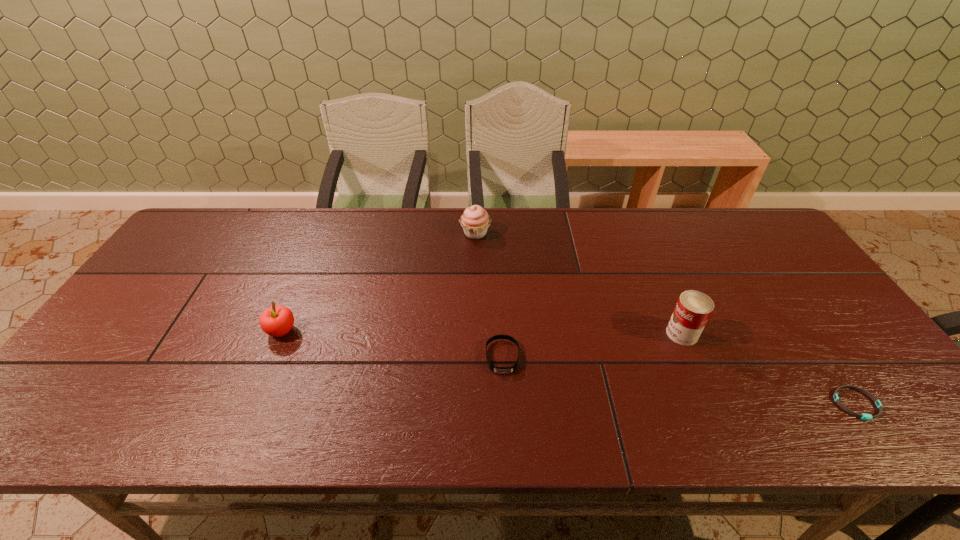
In order to click on vacant region located on the front label of the can in this screenshot , I will do `click(600, 334)`.

In order to click on vacant area located 0.210m on the right of the cupcake in this screenshot , I will do click(x=556, y=233).

The width and height of the screenshot is (960, 540). Identify the location of blank area located 0.250m on the right of the apple. [x=394, y=331].

What are the coordinates of `vacant region located 0.140m on the display of the farther wristband` in the screenshot? It's located at (506, 431).

This screenshot has width=960, height=540. Find the location of `object that is at the far edge`. object that is at the far edge is located at coordinates (475, 221).

This screenshot has width=960, height=540. What are the coordinates of `object that is at the near edge` in the screenshot? It's located at (863, 416).

Where is `object that is at the right edge`? object that is at the right edge is located at coordinates (863, 416).

At what (x,y) coordinates should I click in order to perform the action: click on object present at the near right corner. Please return your answer as a coordinate pair (x, y). The width and height of the screenshot is (960, 540). Looking at the image, I should click on (863, 416).

Where is `vacant area at the far edge of the desktop`? This screenshot has width=960, height=540. vacant area at the far edge of the desktop is located at coordinates (492, 214).

Locate an element on the screen. Image resolution: width=960 pixels, height=540 pixels. vacant space at the near edge of the desktop is located at coordinates (139, 437).